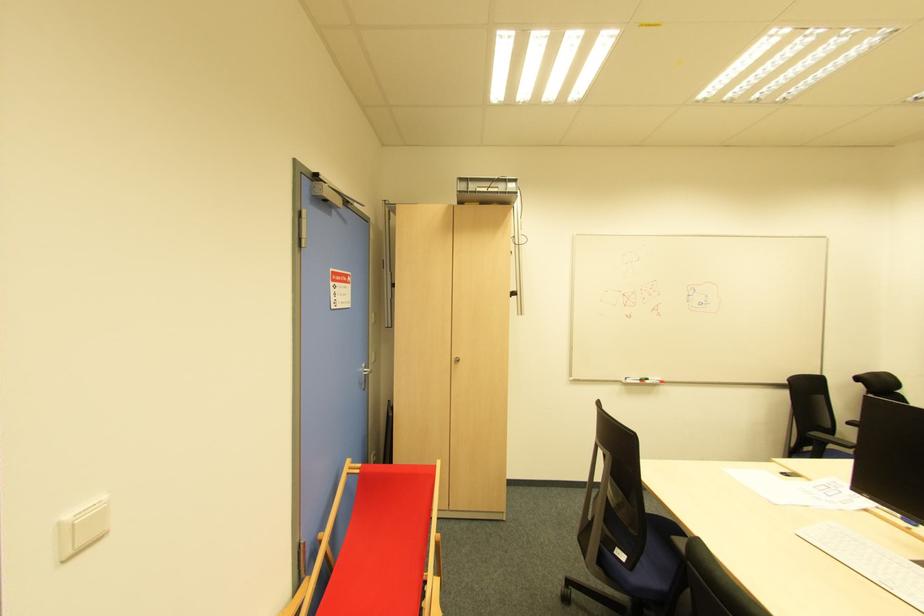
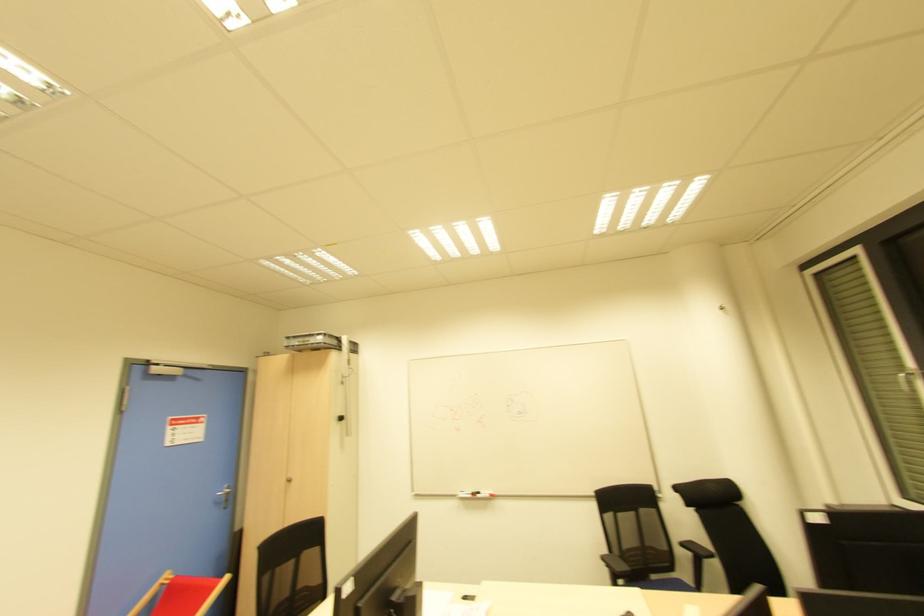
Where in the second image is the point corresponding to point (647, 383) from the first image?

(478, 496)